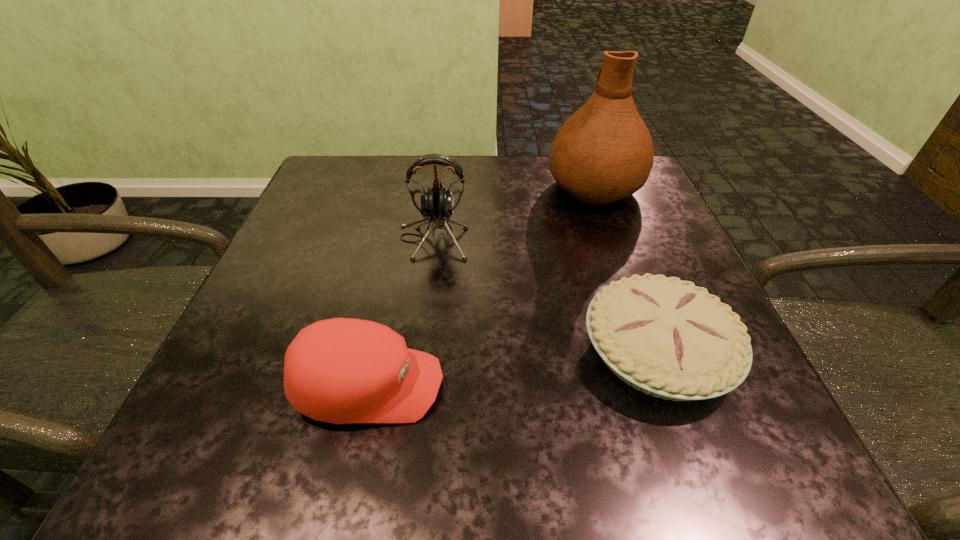
The width and height of the screenshot is (960, 540). I want to click on cap present at the near edge, so click(x=342, y=370).

Find the location of a particular element. The height and width of the screenshot is (540, 960). pie that is at the near edge is located at coordinates (668, 338).

The height and width of the screenshot is (540, 960). I want to click on object that is at the left edge, so click(x=342, y=370).

Identify the location of pitcher that is at the right edge. (603, 153).

At what (x,y) coordinates should I click in order to perform the action: click on pie located at the right edge. Please return your answer as a coordinate pair (x, y). Image resolution: width=960 pixels, height=540 pixels. Looking at the image, I should click on (668, 338).

This screenshot has height=540, width=960. What are the coordinates of `object at the near left corner` in the screenshot? It's located at (342, 370).

Find the location of a particular element. This screenshot has width=960, height=540. object that is at the far right corner is located at coordinates (603, 153).

At what (x,y) coordinates should I click in order to perform the action: click on object that is at the near right corner. Please return your answer as a coordinate pair (x, y). The width and height of the screenshot is (960, 540). Looking at the image, I should click on (668, 338).

This screenshot has width=960, height=540. I want to click on free space at the far edge of the desktop, so click(x=507, y=171).

Locate an element on the screen. Image resolution: width=960 pixels, height=540 pixels. free space at the near edge of the desktop is located at coordinates (519, 414).